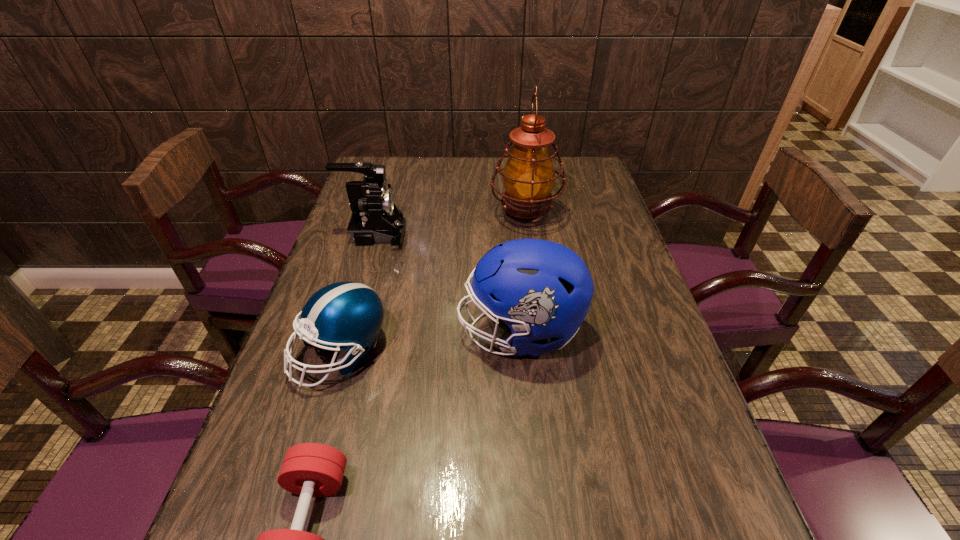
Where is `the tallest object`? the tallest object is located at coordinates (528, 178).

This screenshot has height=540, width=960. I want to click on the taller football helmet, so click(540, 289).

The width and height of the screenshot is (960, 540). I want to click on camcorder, so 375,218.

This screenshot has width=960, height=540. I want to click on the left football helmet, so click(x=348, y=315).

The width and height of the screenshot is (960, 540). I want to click on the fourth tallest object, so click(348, 315).

Identify the location of blank area located 0.180m on the front of the tallest object. (535, 278).

This screenshot has width=960, height=540. I want to click on vacant space located on the face guard of the right football helmet, so click(402, 332).

At what (x,y) coordinates should I click in order to perform the action: click on free location located on the face guard of the right football helmet. Please return your answer as a coordinate pair (x, y). The image size is (960, 540). Looking at the image, I should click on (330, 332).

The height and width of the screenshot is (540, 960). What are the coordinates of `vacant space located on the face guard of the right football helmet` in the screenshot? It's located at (390, 332).

Where is `free space located on the lens mount of the camcorder`? This screenshot has width=960, height=540. free space located on the lens mount of the camcorder is located at coordinates (520, 234).